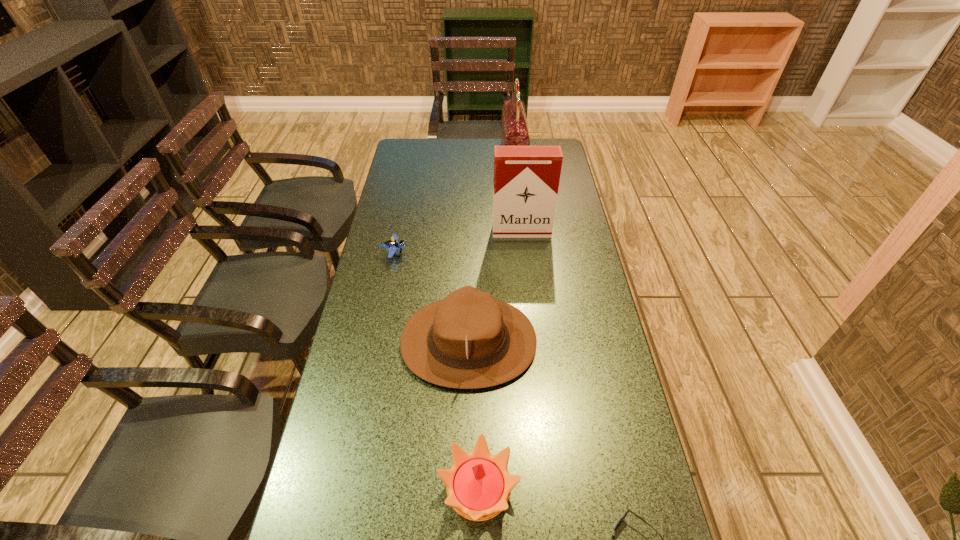
You are a GUI agent. You are given a task and a screenshot of the screen. Output one action in this format:
    pyautogui.click(x=<x>, y=<y>)
    Task: Click on the free space at the right edge
    The width and height of the screenshot is (960, 540).
    Given the screenshot: What is the action you would take?
    pyautogui.click(x=594, y=358)

The image size is (960, 540). Identify the location of vacant point located between the Lego and the farthest object. (454, 206).

You are a GUI agent. You are given a task and a screenshot of the screen. Output one action in this format:
    pyautogui.click(x=<x>, y=<y>)
    Task: Click on the vacant space in between the handbag and the second shortest object
    
    Given the screenshot: What is the action you would take?
    pyautogui.click(x=454, y=206)

Locate an element on the screen. free spot between the third tallest object and the fifth nearest object is located at coordinates (495, 287).

Find the location of a particular element. free space between the fedora and the fifth nearest object is located at coordinates (495, 287).

At what (x,y) coordinates should I click in order to perform the action: click on free point between the second farthest object and the fourth farthest object. Please return your answer as a coordinate pair (x, y). The image size is (960, 540). Looking at the image, I should click on (495, 287).

The width and height of the screenshot is (960, 540). I want to click on free space between the third tallest object and the second farthest object, so click(x=495, y=287).

Identify which object is located as the fourth nearest to the third nearest object. Please provide its 2D coordinates. Your answer should be formatted as a tuple, i.e. [(x, y)], where the tuple contains the x and y coordinates of a point satisfying the conditions above.

[(622, 518)]

What are the coordinates of `object that is the fourth closest to the shortest object` in the screenshot? It's located at pos(392,245).

Locate an element on the screen. This screenshot has height=540, width=960. vacant position in the image that satisfies the following two spatial constraints: 1. on the front-facing side of the Lego; 2. on the right side of the third shortest object is located at coordinates (347, 489).